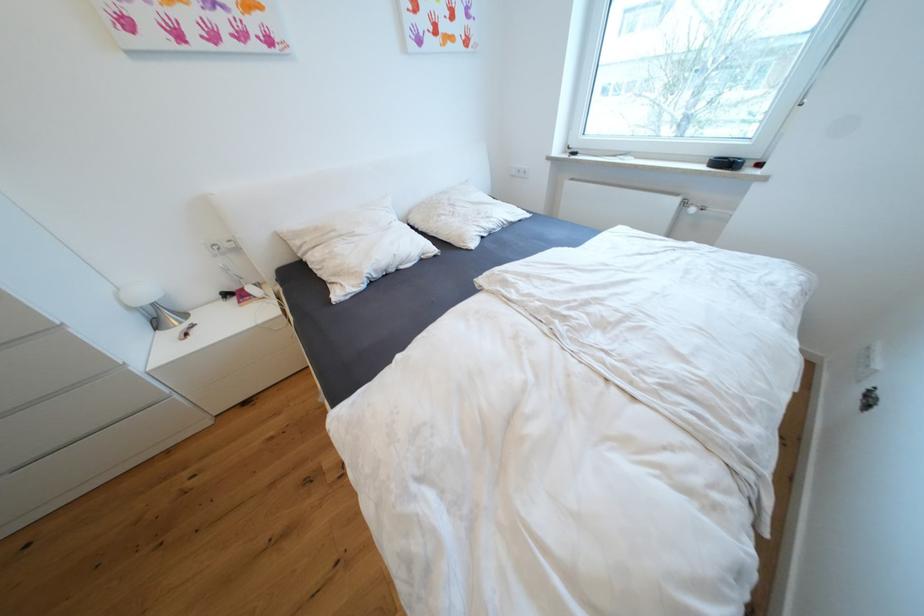
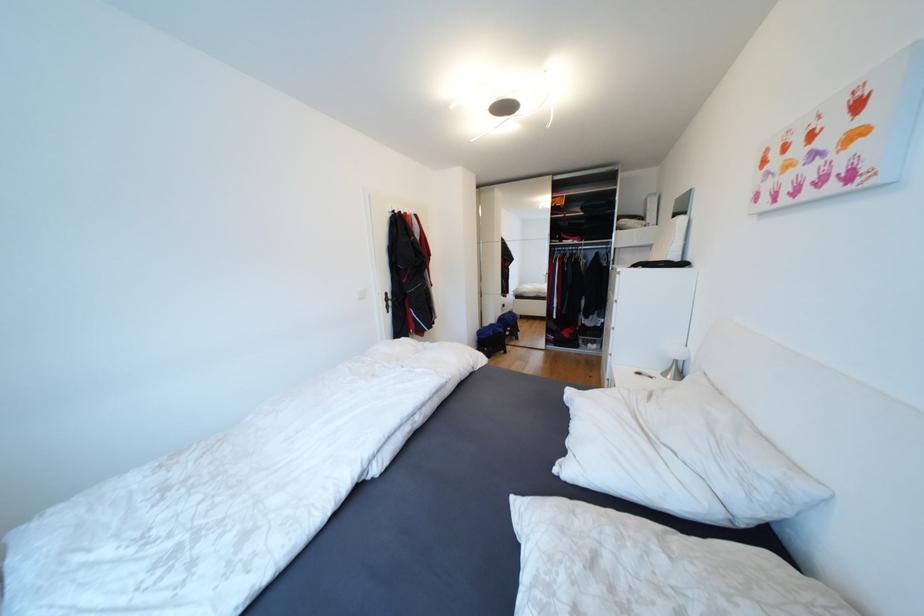
Locate, in the second image, the point that corresponds to pixel 152 296 in the first image.

(682, 354)